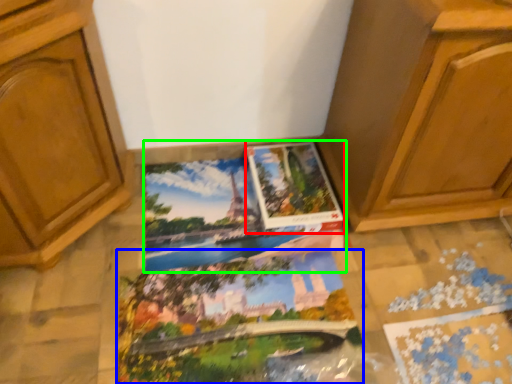
Question: Which object is positioned closest to album (highlighted by a red box)? Select from coloring book (highlighted by a blue box) and coloring book (highlighted by a green box).

Choices:
 (A) coloring book
 (B) coloring book

Answer: (B)